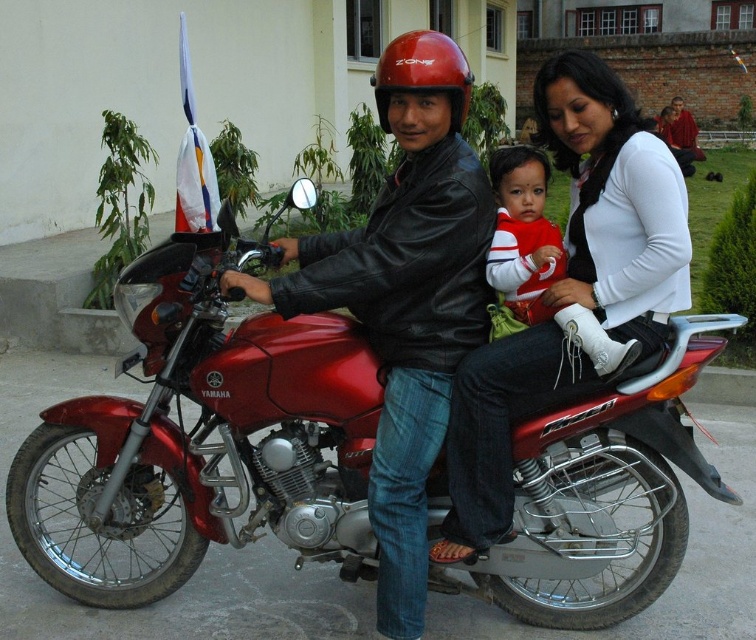
Who is lower down, metallic red motorcycle at center or white leather boot at center?

Positioned lower is metallic red motorcycle at center.

Can you confirm if metallic red motorcycle at center is shorter than white leather boot at center?

No.

Between point (135, 504) and point (516, 307), which one is positioned in front?

Point (516, 307)

Locate an element on the screen. The height and width of the screenshot is (640, 756). metallic red motorcycle at center is located at coordinates (206, 433).

Measure the distance between matte black leather jacket at center and red matte helmet at center.

matte black leather jacket at center is 21.70 inches from red matte helmet at center.

Based on the photo, is matte black leather jacket at center closer to the viewer compared to red matte helmet at center?

Yes.

Who is more forward, (414, 35) or (392, 68)?

Point (392, 68) is in front.

What are the coordinates of `matte black leather jacket at center` in the screenshot? It's located at (404, 296).

Between metallic red motorcycle at center and red and white striped shirt at center, which one is positioned higher?

red and white striped shirt at center

Describe the element at coordinates (206, 433) in the screenshot. I see `metallic red motorcycle at center` at that location.

Find the location of `metallic red motorcycle at center`. metallic red motorcycle at center is located at coordinates (206, 433).